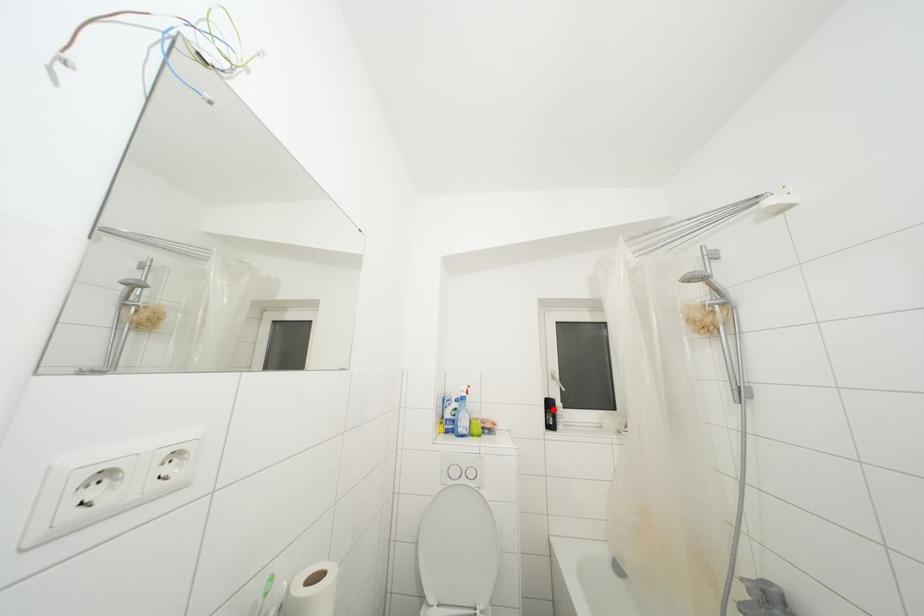
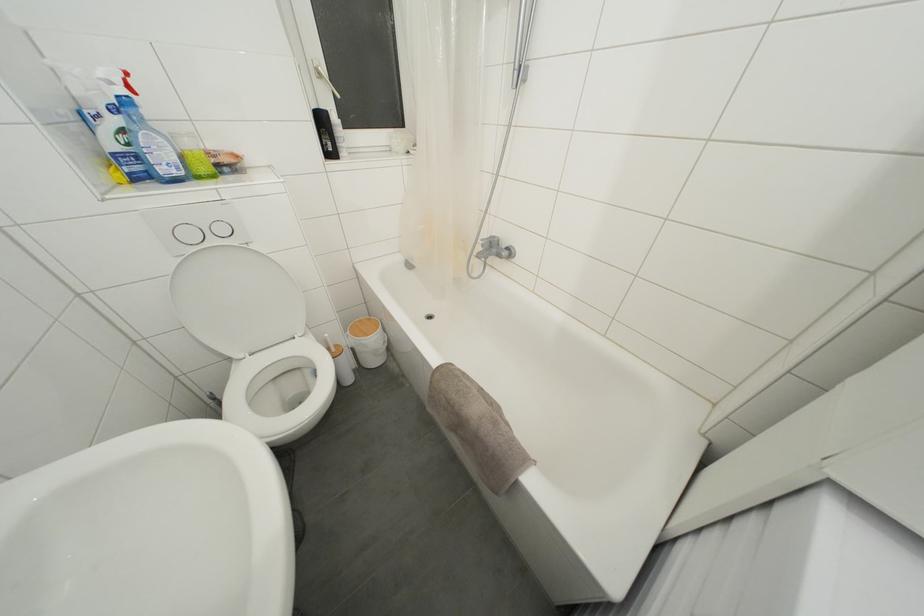
Question: I am providing you with two images of the same scene from different viewpoints. Given a red point in image1, look at the same physical point in image2. Is it:

Choices:
 (A) Closer to the viewpoint
 (B) Farther from the viewpoint

Answer: (A)